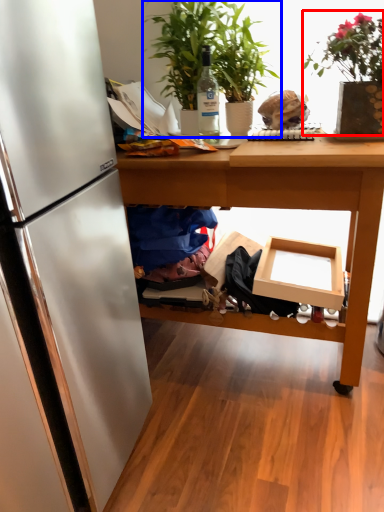
Question: Which object is further to the camera taking this photo, houseplant (highlighted by a red box) or houseplant (highlighted by a blue box)?

Choices:
 (A) houseplant
 (B) houseplant

Answer: (B)